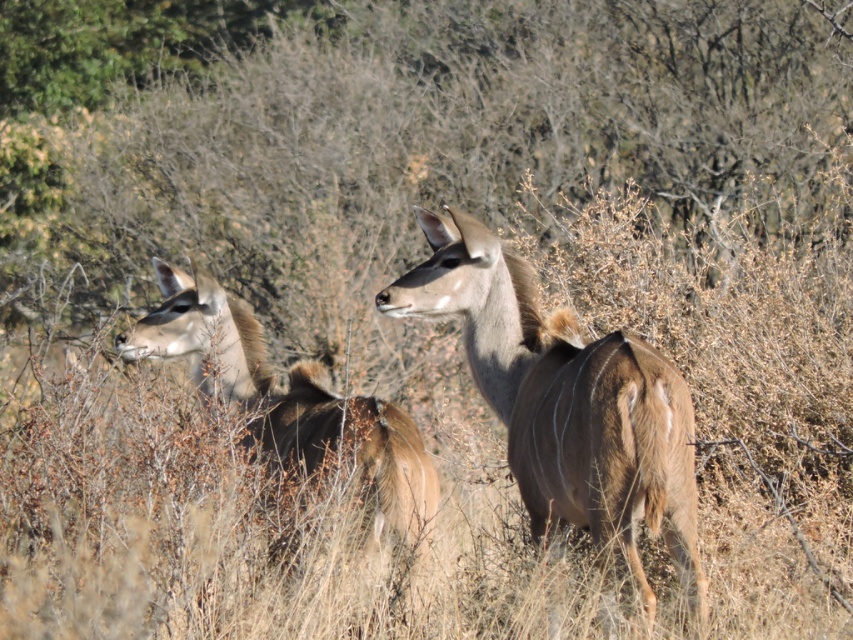
You are a wildlife photographer aiming to capture a clear shot of the brown furry deer at center. Based on its position in the image, which direction should you adjust your camera to focus on it more effectively?

The brown furry deer at center is located at coordinates point [566,401], which means it is positioned slightly to the right and lower part of the frame. To focus on it, adjust your camera slightly to the right and downward.

You are a wildlife photographer aiming to capture a closeup of the brown furry deer at center and the brown furry deer at left. Based on their sizes, which deer would you need to position your camera closer to in order to achieve similar focus and framing?

The brown furry deer at center is smaller than the brown furry deer at left, so you would need to position your camera closer to the brown furry deer at center to achieve similar focus and framing.

You are a photographer trying to capture the antelope in the scene. You notice two points marked in the image. The first point is at coordinate point (618,477) and the second is at point (375,404). Which point is closer to the camera?

Point (618,477) is closer to the camera than point (375,404).